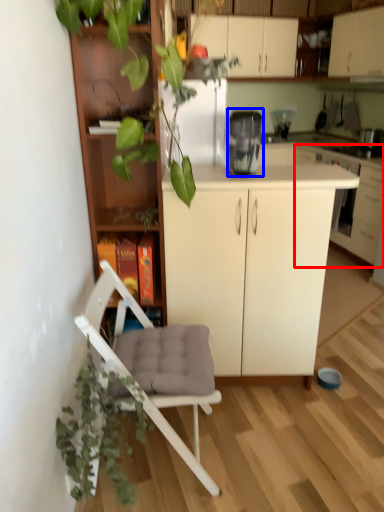
Question: Among these objects, which one is nearest to the camera, cabinetry (highlighted by a red box) or appliance (highlighted by a blue box)?

Choices:
 (A) cabinetry
 (B) appliance

Answer: (B)